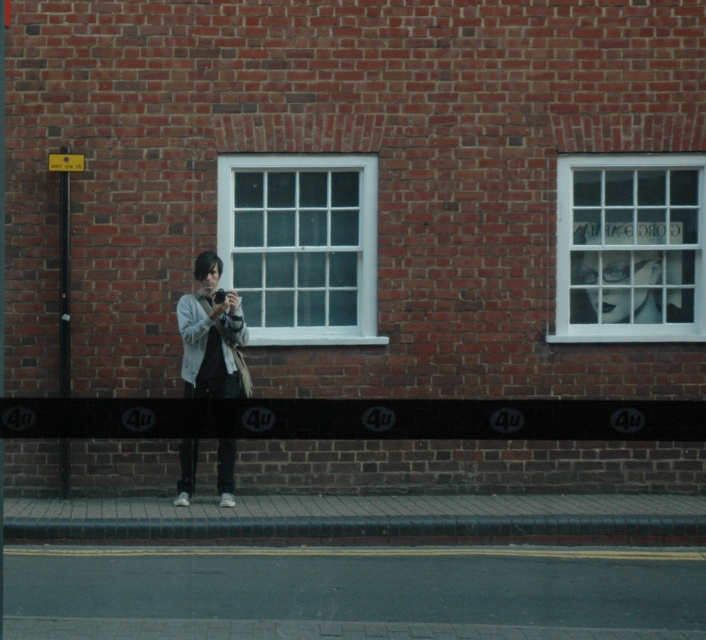
Question: Does white glass window at upper right have a larger size compared to smooth concrete curb at lower center?

Choices:
 (A) yes
 (B) no

Answer: (A)

Question: Which is nearer to the white glass window at center?

Choices:
 (A) matte gray jacket at center
 (B) white glass window at upper right
 (C) smooth concrete curb at lower center

Answer: (A)

Question: Can you confirm if white glass window at upper right is wider than smooth concrete curb at lower center?

Choices:
 (A) no
 (B) yes

Answer: (A)

Question: Is white glass window at center to the left of matte gray jacket at center from the viewer's perspective?

Choices:
 (A) yes
 (B) no

Answer: (B)

Question: Which object appears closest to the camera in this image?

Choices:
 (A) smooth concrete curb at lower center
 (B) matte gray jacket at center
 (C) white glass window at center
 (D) white glass window at upper right

Answer: (A)

Question: Considering the real-world distances, which object is closest to the white glass window at upper right?

Choices:
 (A) white glass window at center
 (B) matte gray jacket at center
 (C) smooth concrete curb at lower center

Answer: (A)